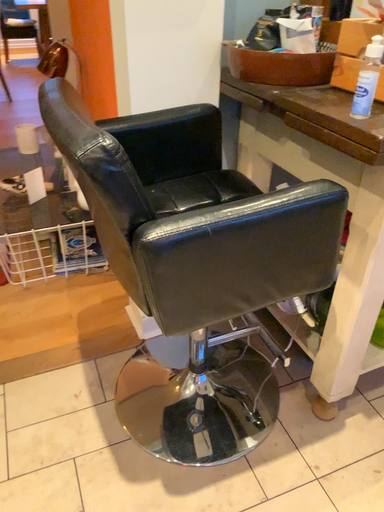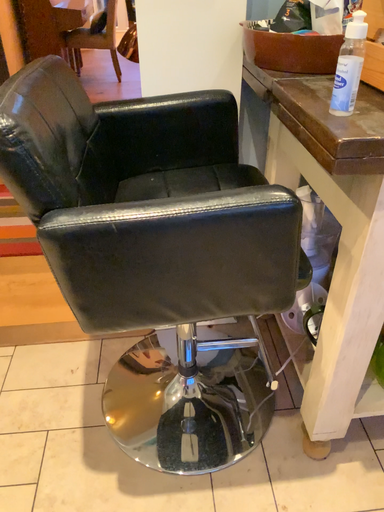
Question: How did the camera likely rotate when shooting the video?

Choices:
 (A) rotated right
 (B) rotated left

Answer: (B)